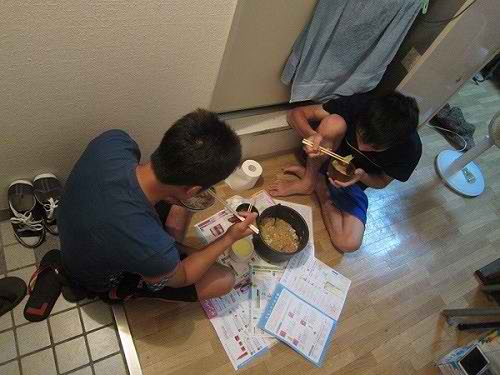
Where is `white tile floor`? white tile floor is located at coordinates (66, 335).